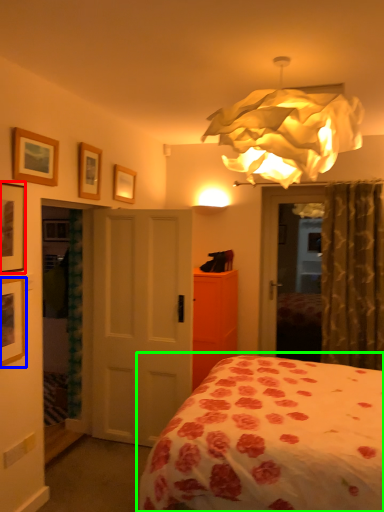
Question: Based on their relative distances, which object is nearer to picture frame (highlighted by a red box)? Choose from picture frame (highlighted by a blue box) and bed (highlighted by a green box).

Choices:
 (A) picture frame
 (B) bed

Answer: (A)